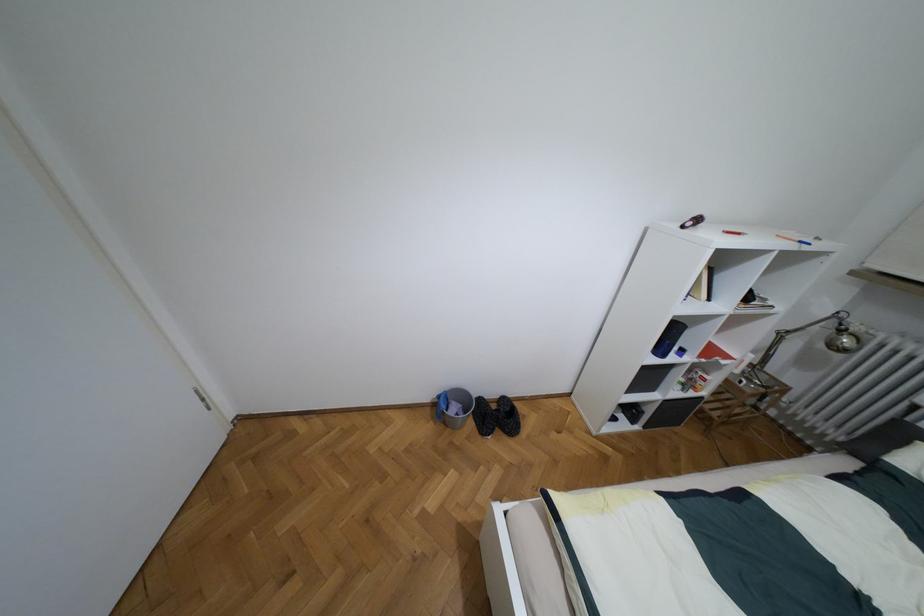
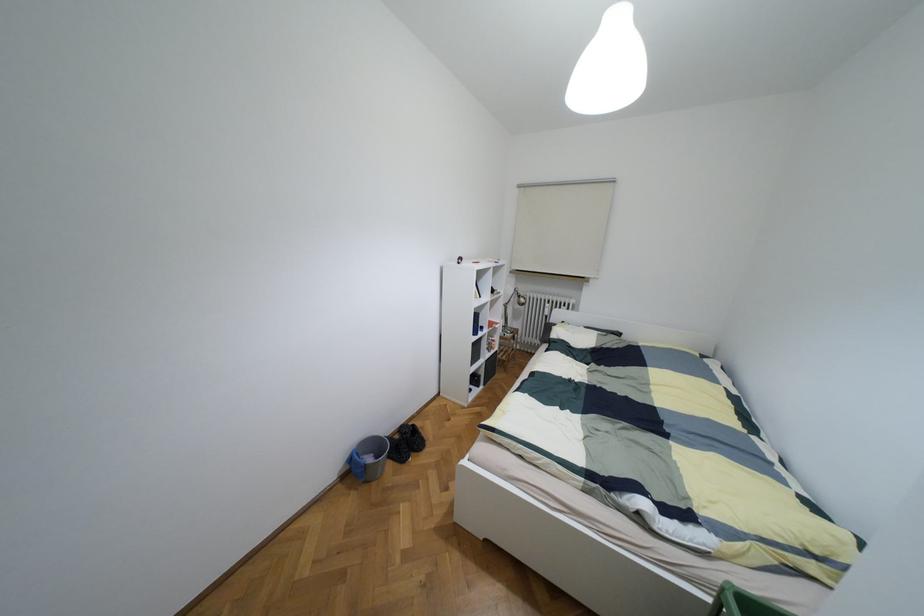
Where in the second image is the point corresponding to (x=453, y=408) from the first image?

(369, 459)